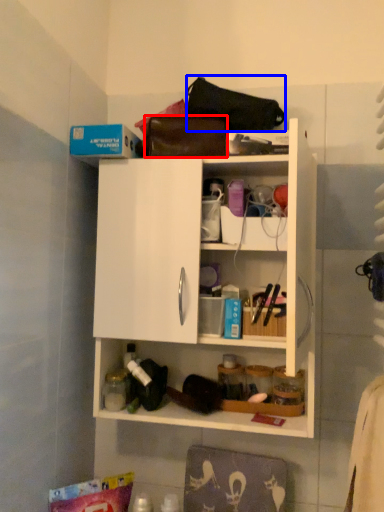
Question: Which of the following is the closest to the observer, handbag (highlighted by a red box) or handbag (highlighted by a blue box)?

Choices:
 (A) handbag
 (B) handbag

Answer: (B)